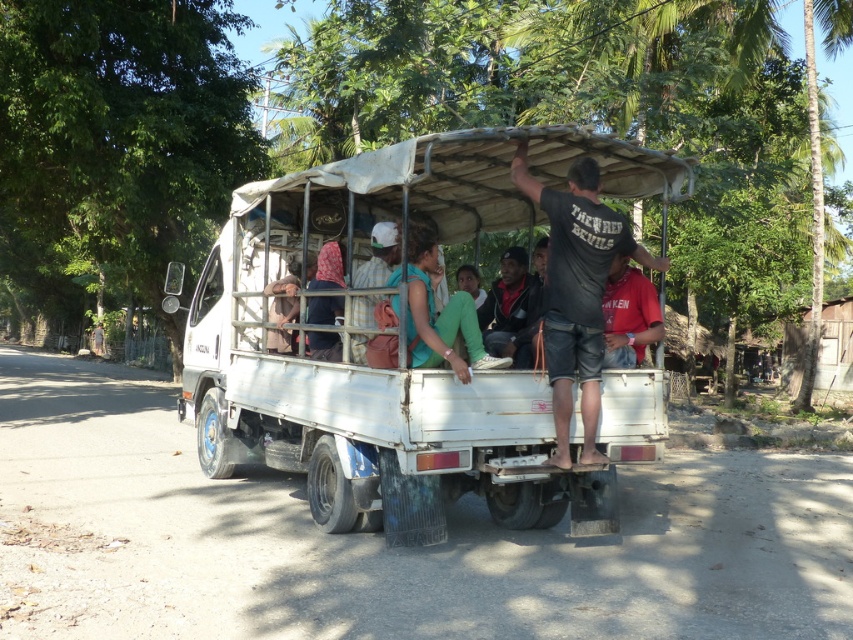
Where is the white matte truck at center located in the image?

The white matte truck at center is located at point (405,339).

You are standing in front of the white pickup truck and want to place a small sticker on the point that is closer to you. Which point should you choose between point (509, 266) and point (608, 314)?

Point (608, 314) is closer to you than point (509, 266), so you should choose point (608, 314) to place the sticker.